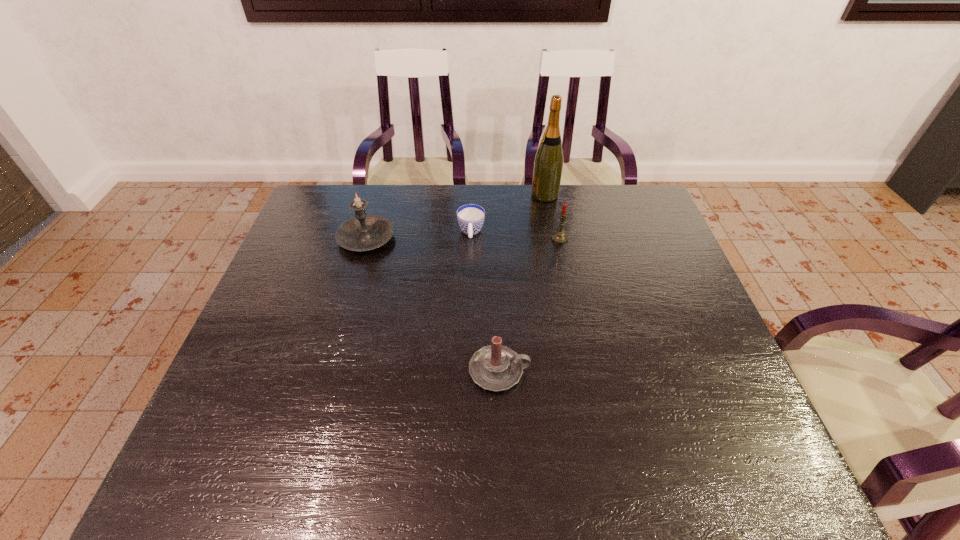
At what (x,y) coordinates should I click in order to perform the action: click on vacant space at the far edge of the desktop. Please return your answer as a coordinate pair (x, y). Image resolution: width=960 pixels, height=540 pixels. Looking at the image, I should click on (379, 202).

This screenshot has height=540, width=960. In the image, there is a desktop. In order to click on free space at the near edge in this screenshot , I will do `click(396, 450)`.

Image resolution: width=960 pixels, height=540 pixels. Find the location of `vacant position at the left edge of the desktop`. vacant position at the left edge of the desktop is located at coordinates (260, 354).

Where is `blank space at the right edge of the desktop`? This screenshot has width=960, height=540. blank space at the right edge of the desktop is located at coordinates (702, 347).

At what (x,y) coordinates should I click in order to perform the action: click on blank space at the far right corner. Please return your answer as a coordinate pair (x, y). This screenshot has height=540, width=960. Looking at the image, I should click on (648, 195).

Where is `vacant region at the near right corner of the desktop`? The height and width of the screenshot is (540, 960). vacant region at the near right corner of the desktop is located at coordinates (759, 456).

Identify the location of unoccupied area between the second tallest object and the rightmost candle. The height and width of the screenshot is (540, 960). pyautogui.click(x=463, y=239).

The width and height of the screenshot is (960, 540). I want to click on vacant region between the nearest object and the leftmost object, so click(x=433, y=305).

Where is `vacant point located between the rightmost candle and the cup`? The height and width of the screenshot is (540, 960). vacant point located between the rightmost candle and the cup is located at coordinates (516, 235).

Find the location of a particular element. The image size is (960, 540). vacant region between the farthest object and the rightmost candle is located at coordinates (552, 217).